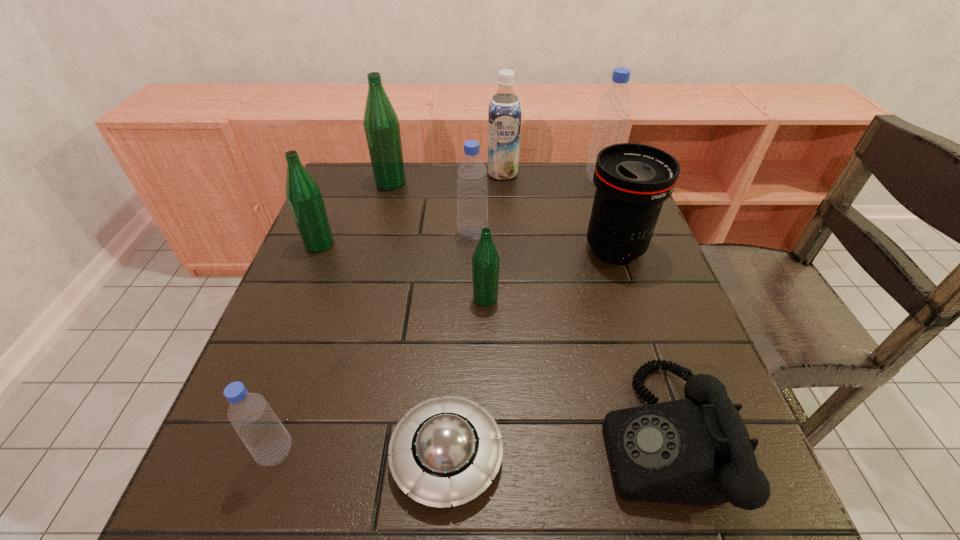
In order to click on the rightmost green bottle in this screenshot , I will do `click(485, 261)`.

Locate an element on the screen. the smallest green bottle is located at coordinates (485, 261).

In order to click on the leftmost blue bottle in this screenshot , I will do `click(266, 438)`.

At what (x,y) coordinates should I click in order to perform the action: click on the smallest blue bottle. Please return your answer as a coordinate pair (x, y). Looking at the image, I should click on pos(266,438).

Find the location of a particular element. This screenshot has height=540, width=960. the second shortest object is located at coordinates (695, 451).

Identify the location of saucer. (446, 450).

Locate an element on the screen. This screenshot has width=960, height=540. gray saucer is located at coordinates (446, 450).

Where is `free spot located on the front of the rightmost bottle`? Image resolution: width=960 pixels, height=540 pixels. free spot located on the front of the rightmost bottle is located at coordinates (611, 207).

Locate an element on the screen. vacant position located 0.050m on the front of the biggest green bottle is located at coordinates (386, 202).

The image size is (960, 540). Find the location of `vacant space located on the label of the soya milk`. vacant space located on the label of the soya milk is located at coordinates (506, 226).